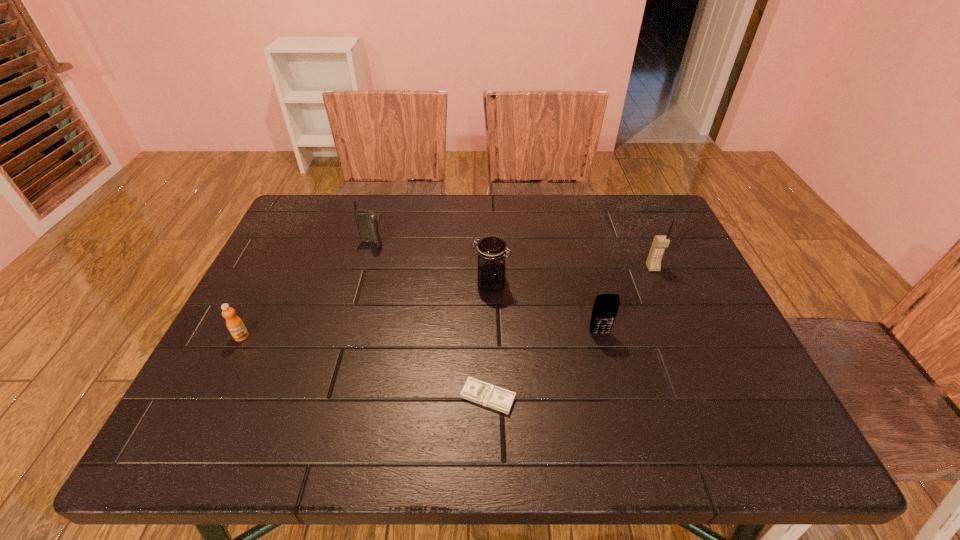
You are a GUI agent. You are given a task and a screenshot of the screen. Output one action in this format:
    pyautogui.click(x=<x>, y=<y>)
    Task: Click on the vacant space that's between the farthest cellular telephone and the third farthest object
    The height and width of the screenshot is (540, 960).
    Given the screenshot: What is the action you would take?
    pyautogui.click(x=431, y=264)

What are the coordinates of `vacant space that is in between the nearest object and the jar` in the screenshot? It's located at (490, 340).

Locate an element on the screen. This screenshot has height=540, width=960. free space that is in between the orange juice and the jar is located at coordinates (366, 310).

At what (x,y) coordinates should I click in order to perform the action: click on vacant region between the orange juice and the shortest object. Please return your answer as a coordinate pair (x, y). Looking at the image, I should click on (365, 367).

Image resolution: width=960 pixels, height=540 pixels. I want to click on empty space between the tallest object and the shortest object, so click(x=570, y=333).

This screenshot has height=540, width=960. I want to click on free spot between the third farthest object and the farthest object, so click(431, 264).

Find the location of a particular element. The image size is (960, 540). vacant space in between the nearest object and the nearest cellular telephone is located at coordinates (543, 365).

Where is `empty space between the fifth object from left to right and the third farthest object`? Image resolution: width=960 pixels, height=540 pixels. empty space between the fifth object from left to right and the third farthest object is located at coordinates (545, 308).

You are a GUI agent. You are given a task and a screenshot of the screen. Output one action in this format:
    pyautogui.click(x=<x>, y=<y>)
    Task: Click on the object that is the fourth closest to the leftmost cellular telephone
    The height and width of the screenshot is (540, 960).
    Given the screenshot: What is the action you would take?
    pyautogui.click(x=605, y=309)

Choose which object is the third nearest neighbor to the orange juice. Please provide its 2D coordinates. Your answer should be formatted as a tuple, i.e. [(x, y)], where the tuple contains the x and y coordinates of a point satisfying the conditions above.

[(491, 266)]